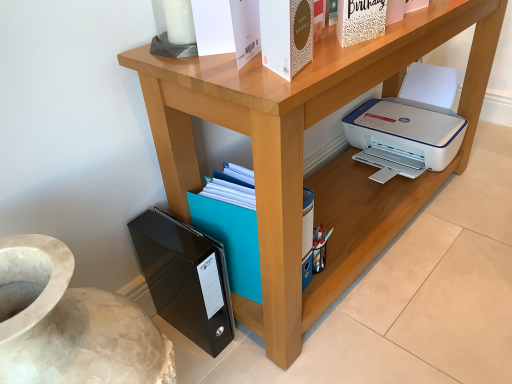
Image resolution: width=512 pixels, height=384 pixels. Find the location of `vacant space in front of black glossy file folder at lower left, the third paperback book viewed from the right`. vacant space in front of black glossy file folder at lower left, the third paperback book viewed from the right is located at coordinates (211, 362).